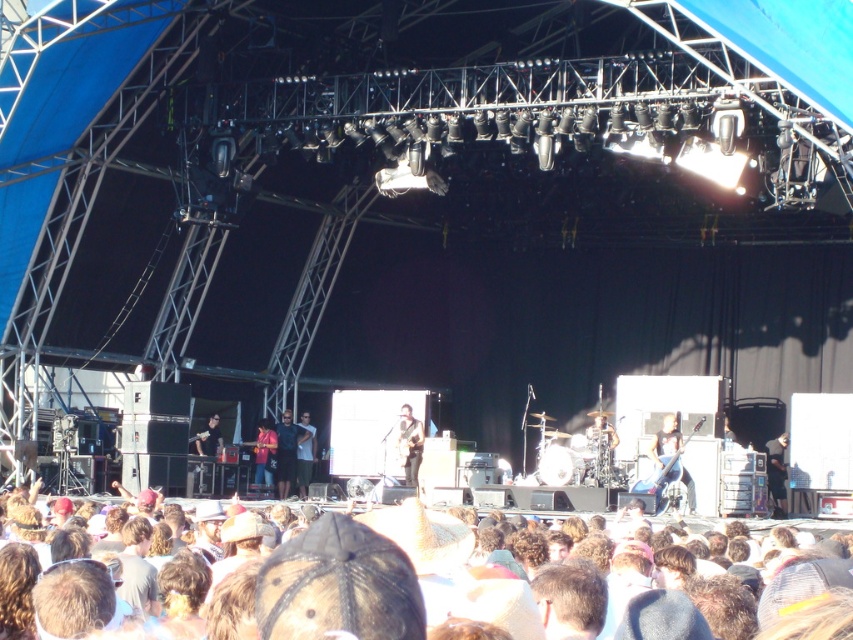
Question: Can you confirm if shiny black guitar at center is positioned above black leather jacket at center?

Choices:
 (A) yes
 (B) no

Answer: (A)

Question: Which object is positioned closest to the black leather guitar at center?

Choices:
 (A) shiny black guitar at center
 (B) denim jacket at center

Answer: (A)

Question: Observing the image, what is the correct spatial positioning of shiny black guitar at center in reference to white shirt at center?

Choices:
 (A) left
 (B) right

Answer: (B)

Question: Is shiny black guitar at center smaller than dark blue jeans at lower left?

Choices:
 (A) no
 (B) yes

Answer: (A)

Question: Which of these objects is positioned closest to the dark blue jeans at lower left?

Choices:
 (A) denim jacket at center
 (B) black leather guitar at center

Answer: (A)

Question: Which point is farther from the camera taking this photo?

Choices:
 (A) (457, 540)
 (B) (769, 452)
 (C) (677, 480)
 (D) (260, 422)

Answer: (D)